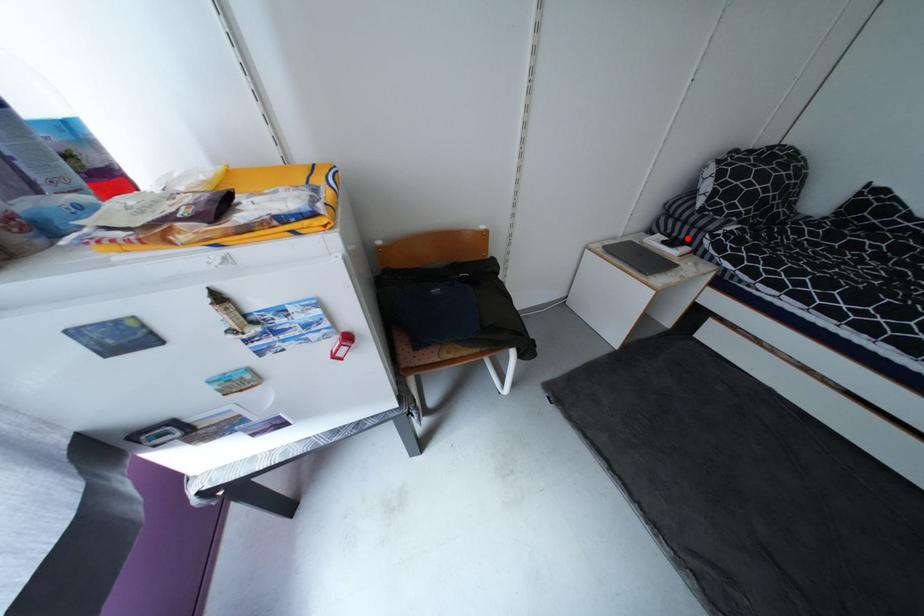
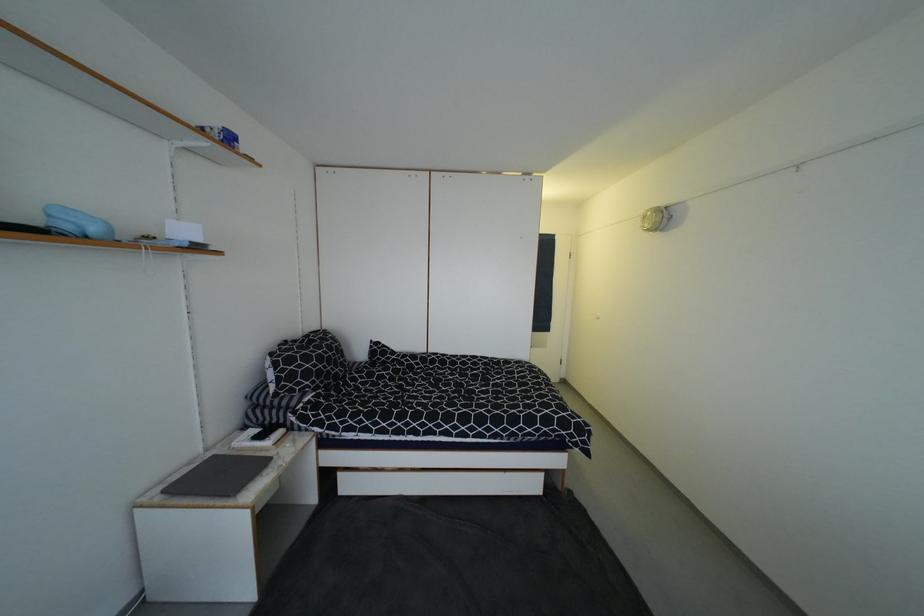
Question: I am providing you with two images of the same scene from different viewpoints. Given a red point in image1, look at the same physical point in image2. Is it:

Choices:
 (A) Closer to the viewpoint
 (B) Farther from the viewpoint

Answer: (B)